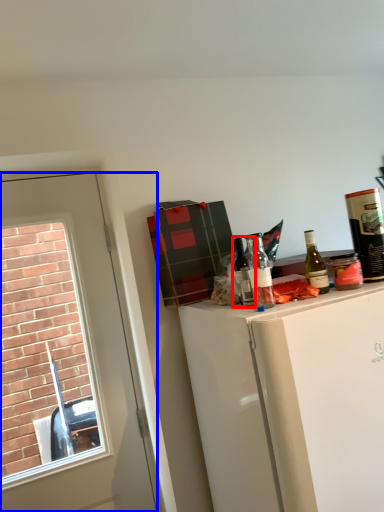
Question: Which object is closer to the camera taking this photo, bottle (highlighted by a red box) or door (highlighted by a blue box)?

Choices:
 (A) bottle
 (B) door

Answer: (A)